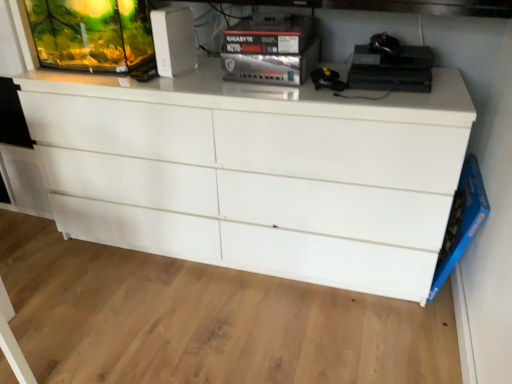
What do you see at coordinates (174, 40) in the screenshot? The image size is (512, 384). I see `white plastic router at upper center` at bounding box center [174, 40].

I want to click on white plastic router at upper center, so click(x=174, y=40).

Locate an element on the screen. The image size is (512, 384). white plastic router at upper center is located at coordinates (174, 40).